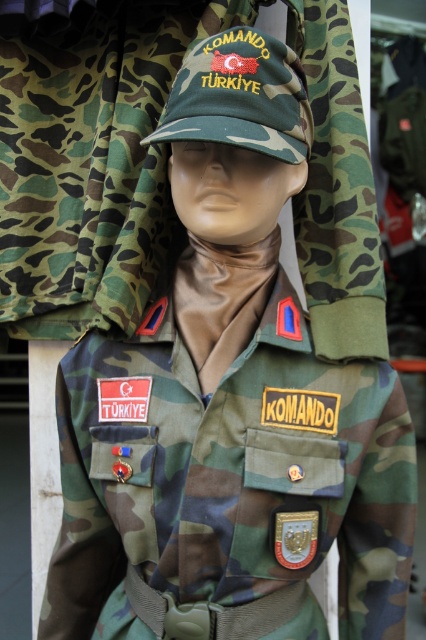
Question: Does camo fabric jacket at upper center appear over camouflage fabric cap at center?

Choices:
 (A) no
 (B) yes

Answer: (A)

Question: Can you confirm if camo fabric jacket at upper center is positioned to the right of camouflage fabric cap at center?

Choices:
 (A) yes
 (B) no

Answer: (B)

Question: Which point is closer to the camera taking this photo?

Choices:
 (A) (198, 68)
 (B) (293, 33)

Answer: (A)

Question: Is camo fabric jacket at upper center closer to the viewer compared to camouflage fabric cap at center?

Choices:
 (A) no
 (B) yes

Answer: (A)